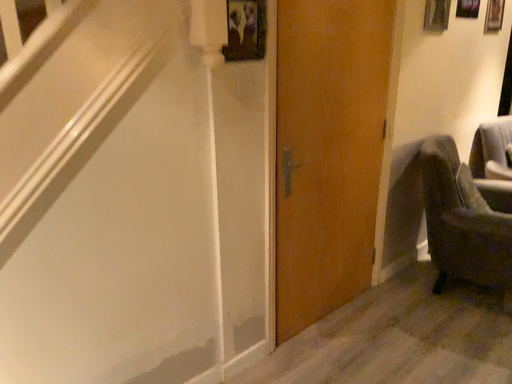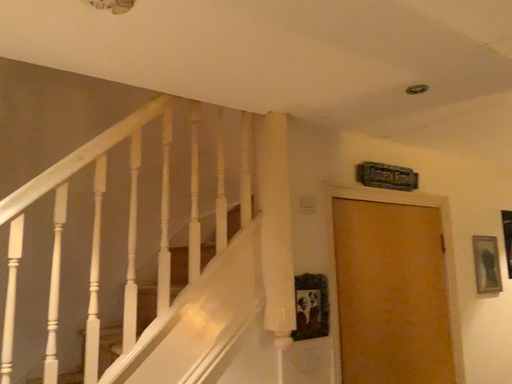
Question: Which way did the camera rotate in the video?

Choices:
 (A) rotated upward
 (B) rotated downward

Answer: (A)